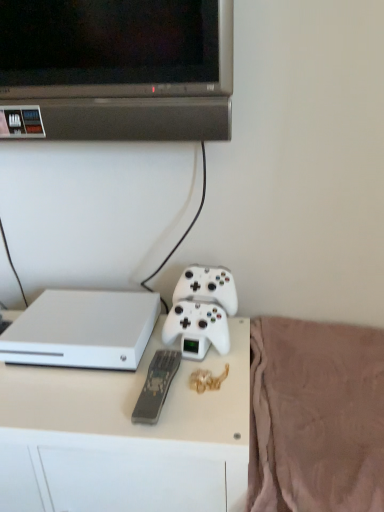
Question: Does white plastic desk at center have a larger size compared to gray matte remote at center?

Choices:
 (A) yes
 (B) no

Answer: (A)

Question: Is white plastic desk at center smaller than gray matte remote at center?

Choices:
 (A) yes
 (B) no

Answer: (B)

Question: Is white plastic desk at center shorter than gray matte remote at center?

Choices:
 (A) yes
 (B) no

Answer: (B)

Question: From the image's perspective, is white plastic desk at center on gray matte remote at center?

Choices:
 (A) no
 (B) yes

Answer: (A)

Question: Is white plastic desk at center outside gray matte remote at center?

Choices:
 (A) yes
 (B) no

Answer: (A)

Question: Does white plastic desk at center turn towards gray matte remote at center?

Choices:
 (A) no
 (B) yes

Answer: (A)

Question: Does white matte gaming console at lower left come in front of white matte game controller at center?

Choices:
 (A) no
 (B) yes

Answer: (B)

Question: Is white matte game controller at center located within white matte gaming console at lower left?

Choices:
 (A) no
 (B) yes

Answer: (A)

Question: Considering the relative sizes of white matte gaming console at lower left and white matte game controller at center in the image provided, is white matte gaming console at lower left shorter than white matte game controller at center?

Choices:
 (A) no
 (B) yes

Answer: (B)

Question: From a real-world perspective, does white matte gaming console at lower left sit lower than white matte game controller at center?

Choices:
 (A) yes
 (B) no

Answer: (A)

Question: Is white matte gaming console at lower left positioned beyond the bounds of white matte game controller at center?

Choices:
 (A) no
 (B) yes

Answer: (B)

Question: Can you confirm if white matte gaming console at lower left is positioned to the right of white matte game controller at center?

Choices:
 (A) yes
 (B) no

Answer: (B)

Question: Is gray matte remote at center surrounding white plastic desk at center?

Choices:
 (A) no
 (B) yes

Answer: (A)